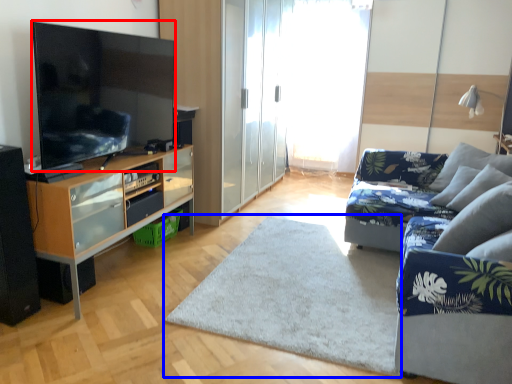
Question: Which object is further to the camera taking this photo, television (highlighted by a red box) or plain (highlighted by a blue box)?

Choices:
 (A) television
 (B) plain

Answer: (A)